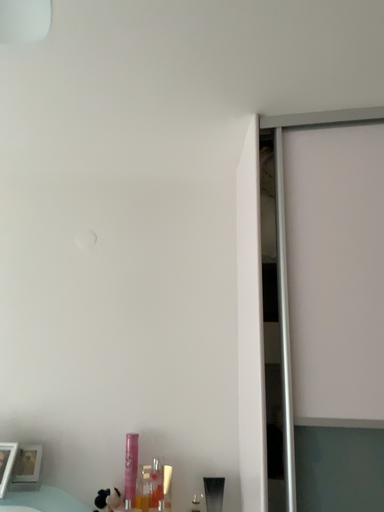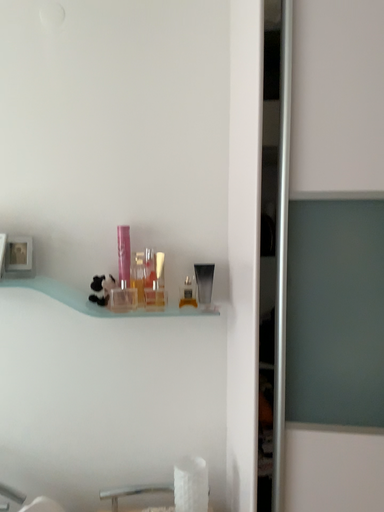
Question: Which way did the camera rotate in the video?

Choices:
 (A) rotated downward
 (B) rotated upward

Answer: (A)